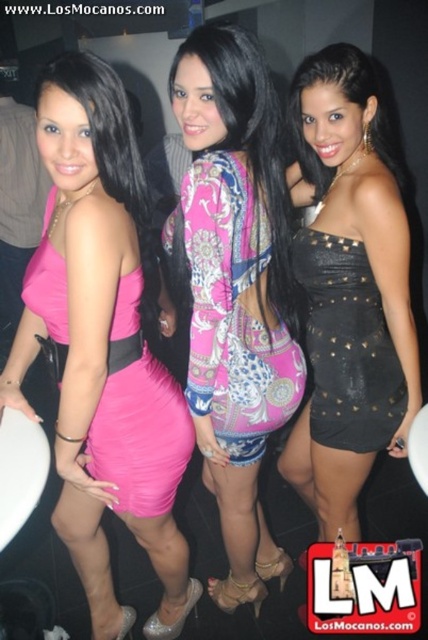
What is the 2D coordinate of the black studded dress at center?

The black studded dress at center is located at the 2D coordinate point of (348,291).

You are a photographer at a party and need to adjust the camera focus. The two women wearing the pink satin dress at left and the pink printed dress at center are standing in a line. Which one should you focus on first if you want to capture both in one shot?

The pink satin dress at left has a lesser height compared to the pink printed dress at center, so you should focus on the pink printed dress at center first as it is taller and might be more prominent in the frame.